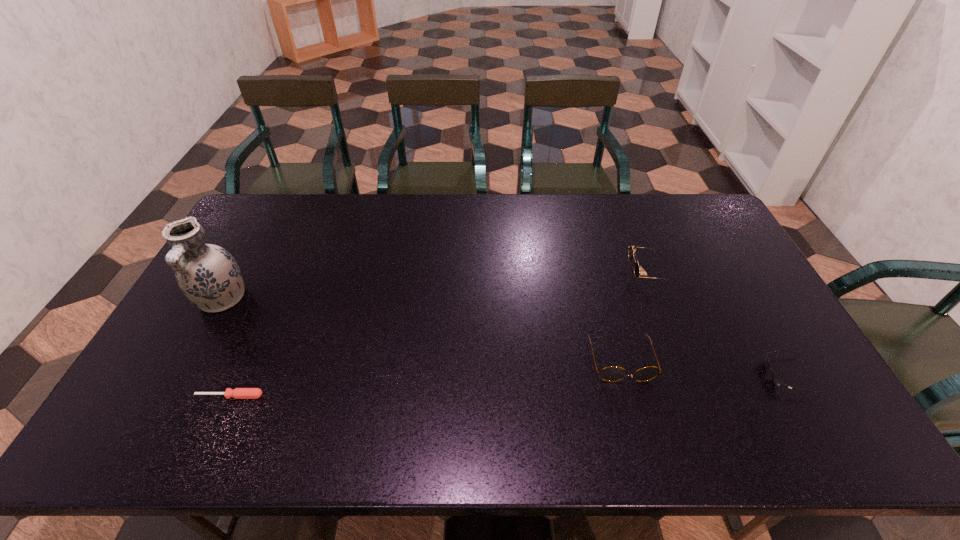
The height and width of the screenshot is (540, 960). Identify the location of vacant space that satisfies the following two spatial constraints: 1. with the handle on the side of the tallest object; 2. on the right side of the screwdriver. (168, 396).

Locate an element on the screen. This screenshot has width=960, height=540. vacant position in the image that satisfies the following two spatial constraints: 1. on the front-facing side of the second shortest object; 2. on the front side of the screwdriver is located at coordinates (800, 396).

Locate an element on the screen. This screenshot has height=540, width=960. free region that satisfies the following two spatial constraints: 1. on the front lenses of the farthest sunglasses; 2. with the handle on the side of the vase is located at coordinates (660, 299).